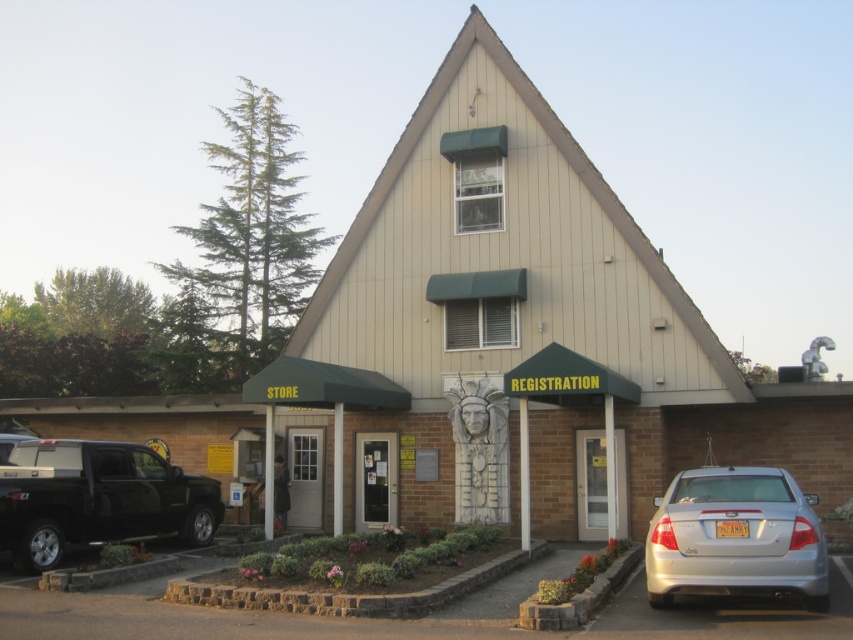
Between silver metallic sedan at lower right and shiny black truck at lower left, which one appears on the left side from the viewer's perspective?

Positioned to the left is shiny black truck at lower left.

In the scene shown: Does silver metallic sedan at lower right appear on the right side of shiny black truck at lower left?

Indeed, silver metallic sedan at lower right is positioned on the right side of shiny black truck at lower left.

This screenshot has height=640, width=853. Describe the element at coordinates (735, 538) in the screenshot. I see `silver metallic sedan at lower right` at that location.

Locate an element on the screen. The height and width of the screenshot is (640, 853). silver metallic sedan at lower right is located at coordinates (735, 538).